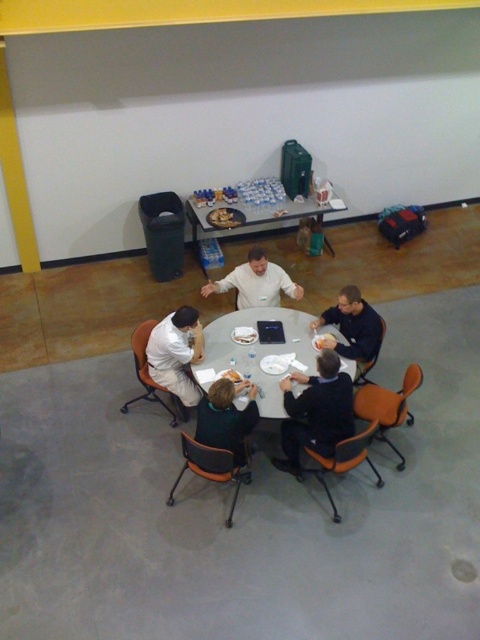
Question: Is metallic silver table at center positioned before white matte shirt at center?

Choices:
 (A) yes
 (B) no

Answer: (B)

Question: Among these points, which one is nearest to the camera?

Choices:
 (A) (257, 198)
 (B) (217, 445)
 (C) (159, 332)

Answer: (B)

Question: Which object is closer to the camera taking this photo?

Choices:
 (A) white matte shirt at center
 (B) dark green sweater at center
 (C) white matte shirt at lower left

Answer: (B)

Question: Estimate the real-world distances between objects in this image. Which object is closer to the dark blue fabric shirt at lower right?

Choices:
 (A) dark blue sweater at lower center
 (B) white matte shirt at center
 (C) white plastic table at center
 (D) dark green sweater at center

Answer: (C)

Question: Does white plastic table at center have a lesser width compared to white matte shirt at lower left?

Choices:
 (A) yes
 (B) no

Answer: (B)

Question: Can you confirm if white plastic table at center is positioned to the right of metallic silver table at center?

Choices:
 (A) no
 (B) yes

Answer: (A)